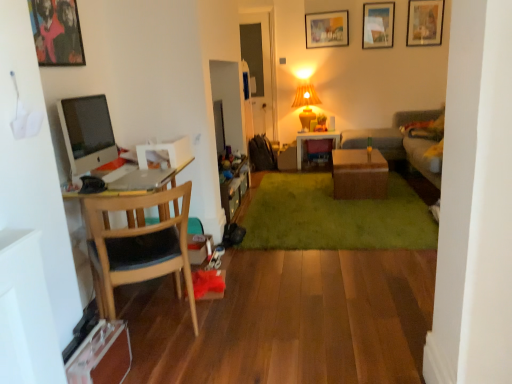
Question: Can you confirm if wooden picture frame at upper center, arranged as the 1th picture frame when viewed from the back, is thinner than matte glass picture frame at upper right, which is counted as the 2th picture frame, starting from the right?

Choices:
 (A) no
 (B) yes

Answer: (A)

Question: Does wooden picture frame at upper center, which is the third picture frame in top-to-bottom order, lie in front of matte glass picture frame at upper right, which is counted as the 2th picture frame, starting from the right?

Choices:
 (A) no
 (B) yes

Answer: (A)

Question: Is wooden picture frame at upper center, the 2th picture frame when ordered from bottom to top, not near matte glass picture frame at upper right, which is counted as the second picture frame, starting from the back?

Choices:
 (A) no
 (B) yes

Answer: (A)

Question: Is wooden picture frame at upper center, which is the third picture frame in top-to-bottom order, outside matte glass picture frame at upper right, which is the 2th picture frame from top to bottom?

Choices:
 (A) no
 (B) yes

Answer: (B)

Question: From the image's perspective, is wooden picture frame at upper center, which is the third picture frame in top-to-bottom order, located above matte glass picture frame at upper right, which is the 2th picture frame from top to bottom?

Choices:
 (A) no
 (B) yes

Answer: (A)

Question: Is silver metallic laptop at left inside the boundaries of wooden chair at left, or outside?

Choices:
 (A) outside
 (B) inside

Answer: (B)

Question: Is silver metallic laptop at left in front of or behind wooden chair at left in the image?

Choices:
 (A) behind
 (B) front

Answer: (A)

Question: Based on their positions, is silver metallic laptop at left located to the left or right of wooden chair at left?

Choices:
 (A) right
 (B) left

Answer: (B)

Question: From the image's perspective, is silver metallic laptop at left above or below wooden chair at left?

Choices:
 (A) above
 (B) below

Answer: (A)

Question: Is silver metallic laptop at left wider or thinner than brown wicker table at center, which appears as the second table when viewed from the back?

Choices:
 (A) wide
 (B) thin

Answer: (B)

Question: Would you say silver metallic laptop at left is inside or outside brown wicker table at center, which appears as the second table when viewed from the back?

Choices:
 (A) inside
 (B) outside

Answer: (B)

Question: From the image's perspective, is silver metallic laptop at left located above or below brown wicker table at center, arranged as the 1th table when viewed from the front?

Choices:
 (A) below
 (B) above

Answer: (A)

Question: From a real-world perspective, is silver metallic laptop at left above or below brown wicker table at center, which appears as the second table when viewed from the back?

Choices:
 (A) above
 (B) below

Answer: (A)

Question: Would you say wooden picture frame at upper center, which appears as the 2th picture frame when viewed from the left, is inside or outside wooden cabinet at center?

Choices:
 (A) inside
 (B) outside

Answer: (B)

Question: Does point (322, 44) appear closer or farther from the camera than point (236, 188)?

Choices:
 (A) closer
 (B) farther

Answer: (B)